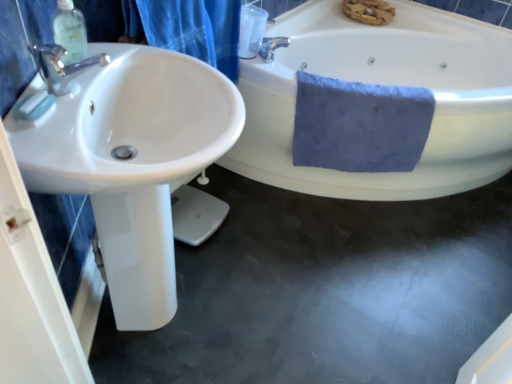
Question: From the image's perspective, is white glossy bathtub at upper right above white glossy sink at left?

Choices:
 (A) no
 (B) yes

Answer: (B)

Question: Does white glossy bathtub at upper right have a lesser height compared to white glossy sink at left?

Choices:
 (A) yes
 (B) no

Answer: (A)

Question: Can you confirm if white glossy bathtub at upper right is positioned to the right of white glossy sink at left?

Choices:
 (A) no
 (B) yes

Answer: (B)

Question: Is white glossy bathtub at upper right bigger than white glossy sink at left?

Choices:
 (A) no
 (B) yes

Answer: (B)

Question: Is white glossy bathtub at upper right placed right next to white glossy sink at left?

Choices:
 (A) no
 (B) yes

Answer: (A)

Question: Considering the positions of point (333, 84) and point (497, 153), is point (333, 84) closer or farther from the camera than point (497, 153)?

Choices:
 (A) farther
 (B) closer

Answer: (B)

Question: Considering the positions of blue soft towel at right and white glossy bathtub at upper right in the image, is blue soft towel at right wider or thinner than white glossy bathtub at upper right?

Choices:
 (A) thin
 (B) wide

Answer: (A)

Question: In the image, is blue soft towel at right on the left side or the right side of white glossy bathtub at upper right?

Choices:
 (A) left
 (B) right

Answer: (A)

Question: Is blue soft towel at right taller or shorter than white glossy bathtub at upper right?

Choices:
 (A) short
 (B) tall

Answer: (A)

Question: Does point (81, 33) appear closer or farther from the camera than point (421, 147)?

Choices:
 (A) closer
 (B) farther

Answer: (A)

Question: Relative to blue soft towel at right, is clear plastic soap dispenser at upper left in front or behind?

Choices:
 (A) behind
 (B) front

Answer: (B)

Question: Considering the relative positions of clear plastic soap dispenser at upper left and blue soft towel at right in the image provided, is clear plastic soap dispenser at upper left to the left or to the right of blue soft towel at right?

Choices:
 (A) left
 (B) right

Answer: (A)

Question: Looking at their shapes, would you say clear plastic soap dispenser at upper left is wider or thinner than blue soft towel at right?

Choices:
 (A) wide
 (B) thin

Answer: (B)

Question: In terms of width, does white glossy bathtub at upper right look wider or thinner when compared to clear plastic soap dispenser at upper left?

Choices:
 (A) thin
 (B) wide

Answer: (B)

Question: Is white glossy bathtub at upper right bigger or smaller than clear plastic soap dispenser at upper left?

Choices:
 (A) small
 (B) big

Answer: (B)